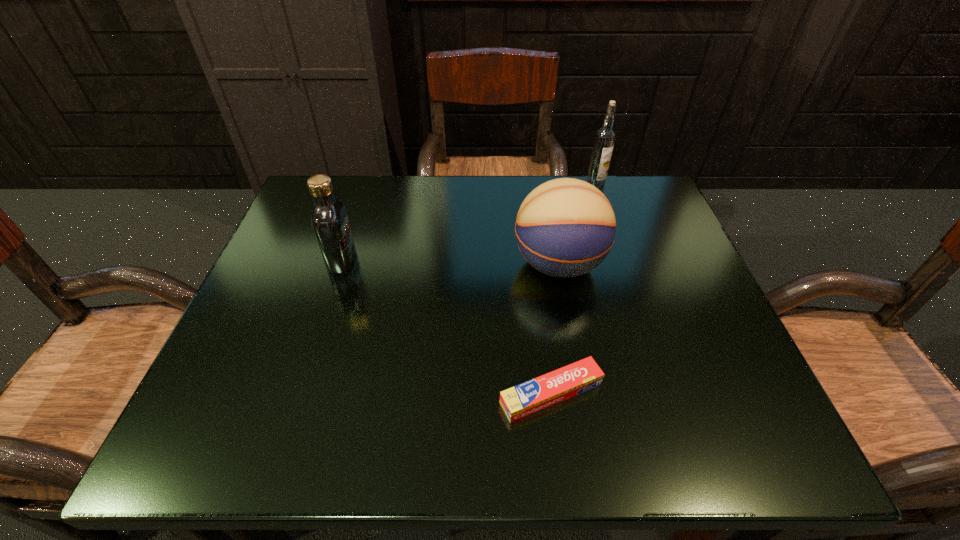
At what (x,y) coordinates should I click in order to perform the action: click on free space located on the patterned surface of the basketball. Please return your answer as a coordinate pair (x, y). Looking at the image, I should click on (489, 265).

This screenshot has height=540, width=960. In order to click on vacant space located on the patterned surface of the basketball in this screenshot , I will do `click(451, 265)`.

The height and width of the screenshot is (540, 960). Identify the location of free space located 0.340m on the back of the nearest object. (532, 239).

You are a GUI agent. You are given a task and a screenshot of the screen. Output one action in this format:
    pyautogui.click(x=<x>, y=<y>)
    Task: Click on the object that is positioned at the far edge
    This screenshot has height=540, width=960.
    Given the screenshot: What is the action you would take?
    pyautogui.click(x=605, y=137)

Find the location of a particular element. object that is at the near edge is located at coordinates (524, 399).

This screenshot has width=960, height=540. In order to click on object present at the left edge in this screenshot , I will do `click(330, 222)`.

Where is `object positioned at the right edge`? This screenshot has width=960, height=540. object positioned at the right edge is located at coordinates (605, 137).

This screenshot has height=540, width=960. I want to click on object at the far right corner, so click(x=605, y=137).

Locate an element on the screen. The image size is (960, 540). vacant region at the far edge of the desktop is located at coordinates (468, 206).

At what (x,y) coordinates should I click in order to perform the action: click on vacant area at the near edge of the desktop. Please return your answer as a coordinate pair (x, y). Image resolution: width=960 pixels, height=540 pixels. Looking at the image, I should click on (655, 417).